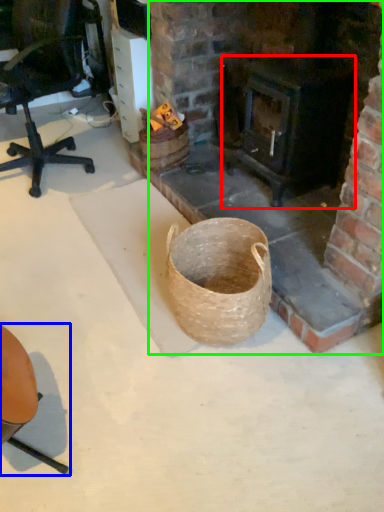
Question: Estimate the real-world distances between objects in this image. Which object is closer to stove (highlighted by a red box), chair (highlighted by a blue box) or fireplace (highlighted by a green box)?

Choices:
 (A) chair
 (B) fireplace

Answer: (B)